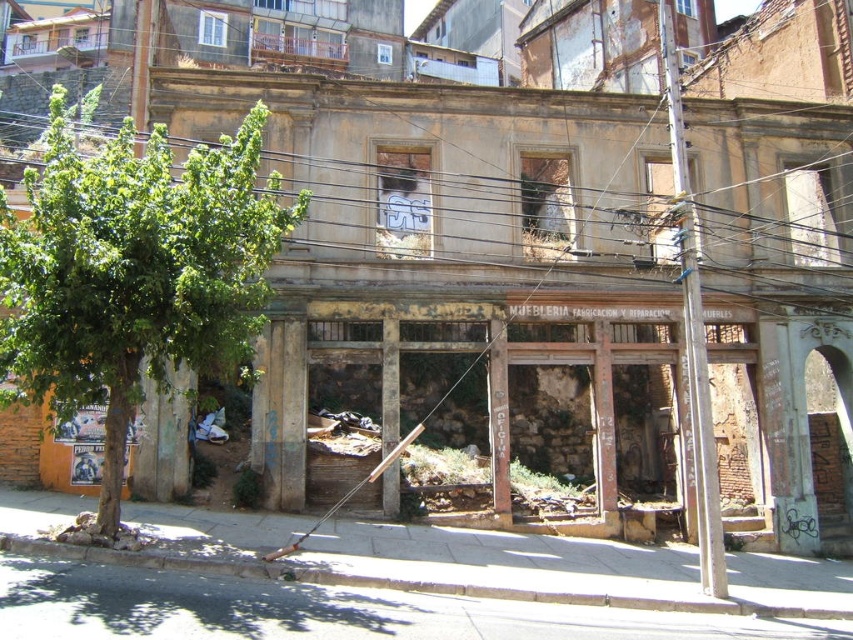
Question: Which point is farther to the camera?

Choices:
 (A) brown wooden power line at upper center
 (B) green leafy tree at left

Answer: (A)

Question: Can you confirm if brown wooden power line at upper center is bigger than green leafy tree at left?

Choices:
 (A) no
 (B) yes

Answer: (B)

Question: Is brown wooden power line at upper center below green leafy tree at left?

Choices:
 (A) no
 (B) yes

Answer: (A)

Question: Among these points, which one is nearest to the camera?

Choices:
 (A) (74, 186)
 (B) (207, 145)

Answer: (A)

Question: Is brown wooden power line at upper center above green leafy tree at left?

Choices:
 (A) yes
 (B) no

Answer: (A)